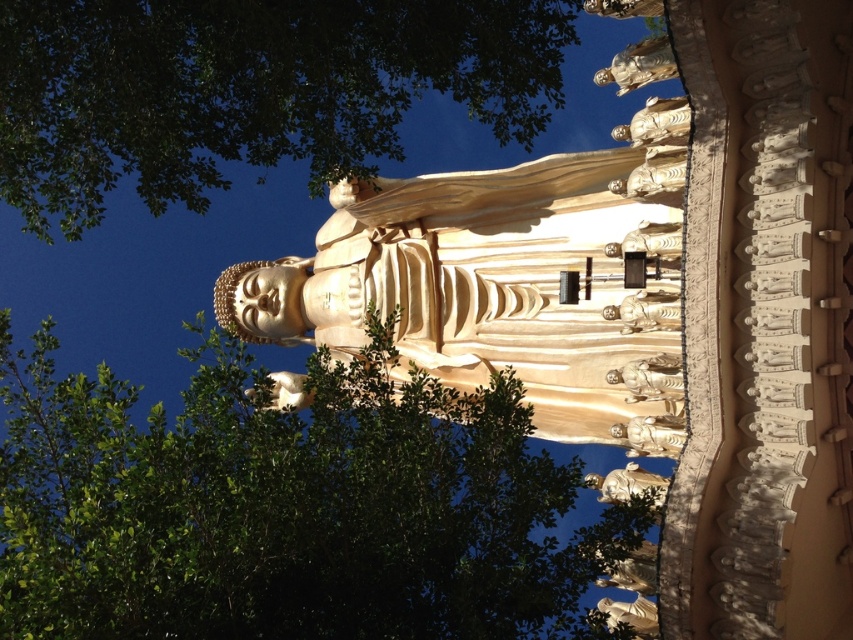
From the picture: You are standing in front of the large golden Buddha statue at the center of the scene. There is a specific point marked at coordinates (654,173). Can you identify what object this point is pointing to?

The point at coordinates (654,173) corresponds to the gold textured statue at center.

You are a visitor standing in front of the gold polished statue at upper center and the smooth beige statue at center. Which statue is positioned to the right side?

The gold polished statue at upper center is positioned to the right of the smooth beige statue at center.